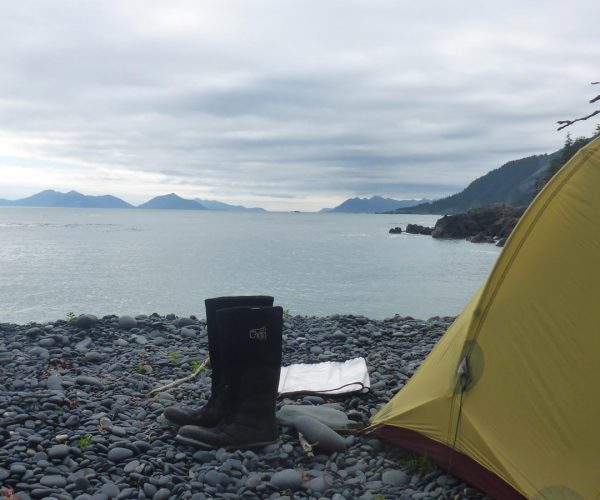
The width and height of the screenshot is (600, 500). Find the location of `white cloth`. white cloth is located at coordinates (329, 375).